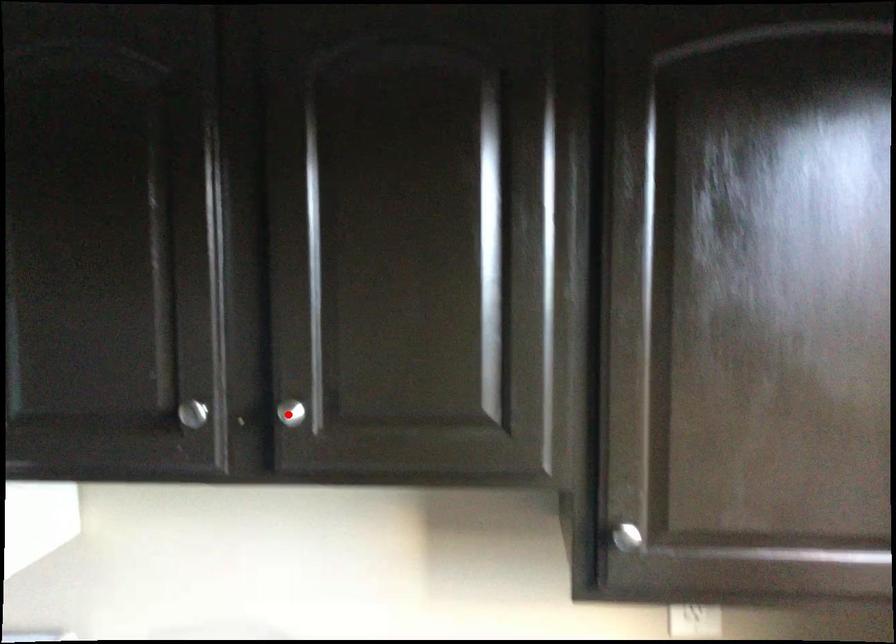
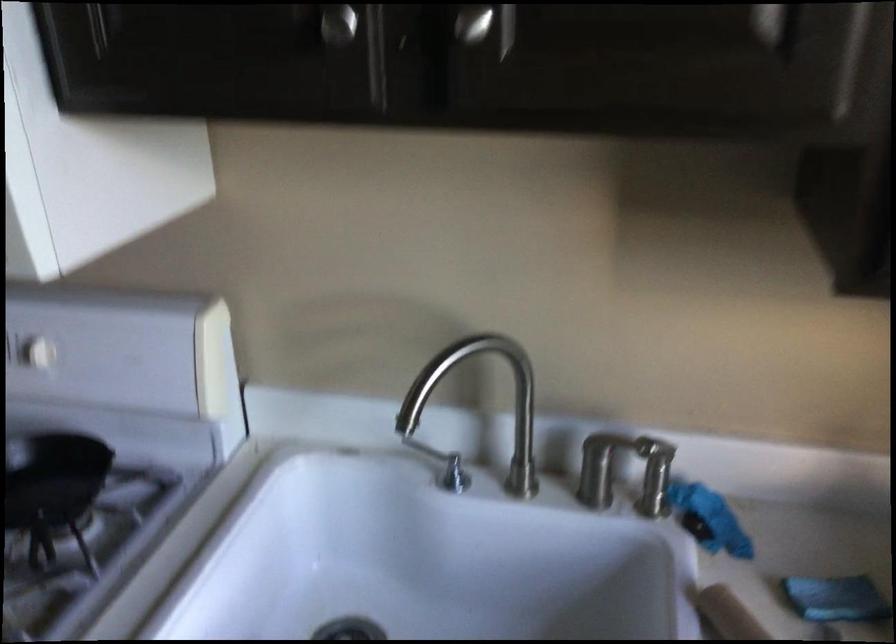
Question: A red point is marked in image1. In image2, is the corresponding 3D point closer to the camera or farther? Reply with the corresponding letter.

Choices:
 (A) The corresponding 3D point is closer.
 (B) The corresponding 3D point is farther.

Answer: (A)